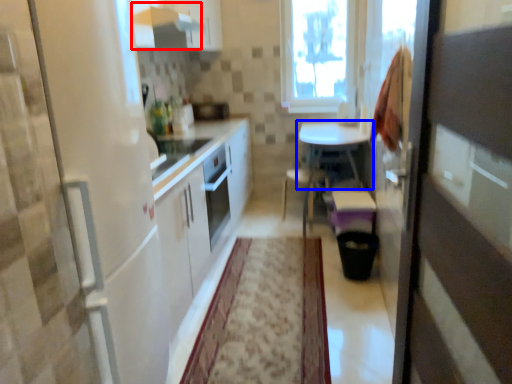
Question: Which object appears farthest to the camera in this image, exhaust hood (highlighted by a red box) or table (highlighted by a blue box)?

Choices:
 (A) exhaust hood
 (B) table

Answer: (B)